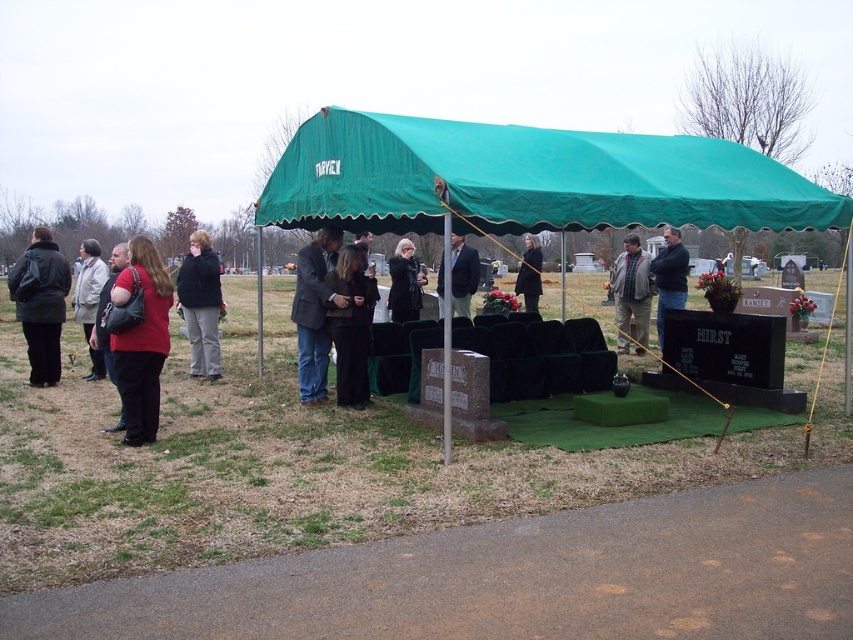
Question: Is green fabric canopy at center smaller than matte red shirt at center?

Choices:
 (A) no
 (B) yes

Answer: (B)

Question: Is dark gray jacket at center to the right of gray wool jacket at center from the viewer's perspective?

Choices:
 (A) no
 (B) yes

Answer: (A)

Question: Estimate the real-world distances between objects in this image. Which object is closer to the gray wool jacket at center?

Choices:
 (A) dark gray suit at center
 (B) dark blue suit at center
 (C) green fabric tent at center

Answer: (B)

Question: Is dark gray suit at center wider than black fabric coat at center?

Choices:
 (A) no
 (B) yes

Answer: (B)

Question: Which of these objects is positioned closest to the light beige coat at left?

Choices:
 (A) dark blue suit at center
 (B) green fabric tent at center

Answer: (B)

Question: Which object is closer to the camera taking this photo?

Choices:
 (A) gray wool jacket at center
 (B) green fabric tent at center

Answer: (B)